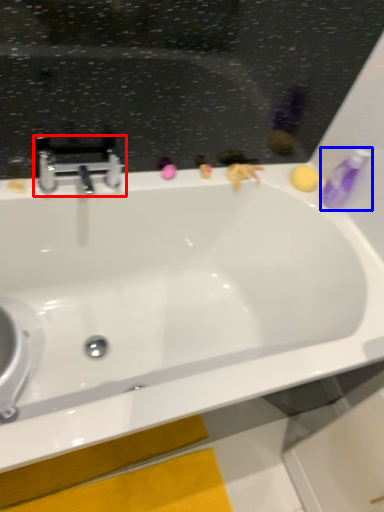
Question: Which object is closer to the camera taking this photo, tap (highlighted by a red box) or toiletry (highlighted by a blue box)?

Choices:
 (A) tap
 (B) toiletry

Answer: (A)